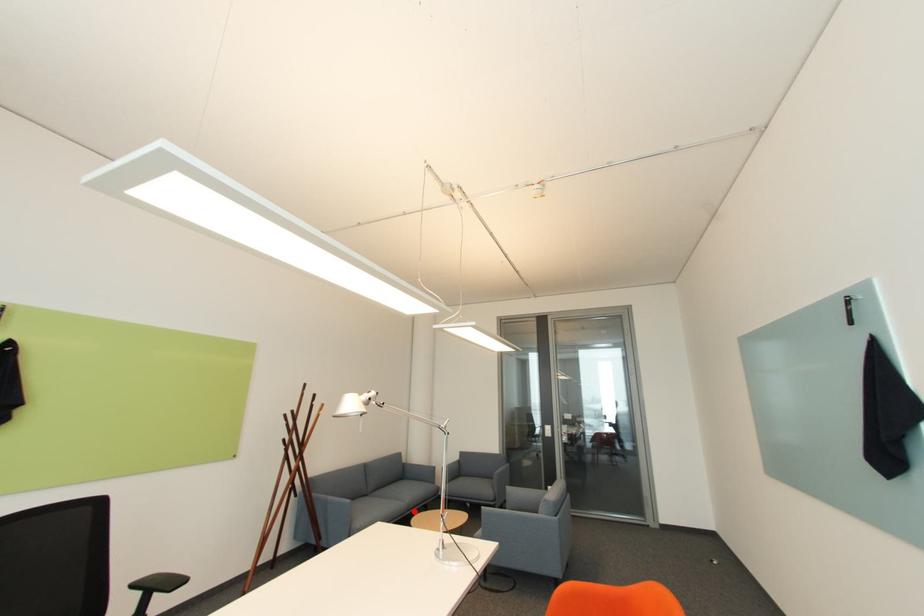
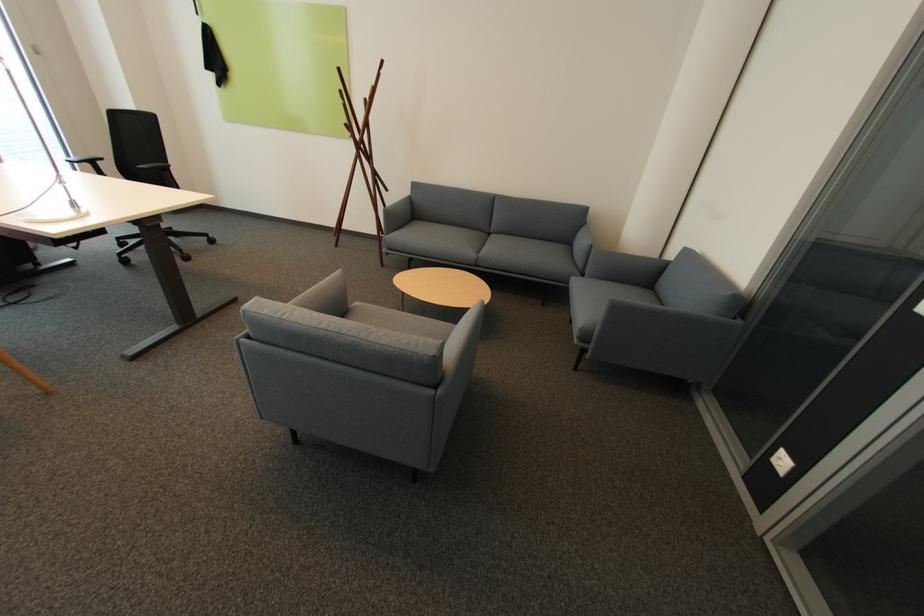
Question: I am providing you with two images of the same scene from different viewpoints. A red point is shown in image1. For the corresponding object point in image2, is it positioned nearer or farther from the camera?

Choices:
 (A) Nearer
 (B) Farther

Answer: (A)